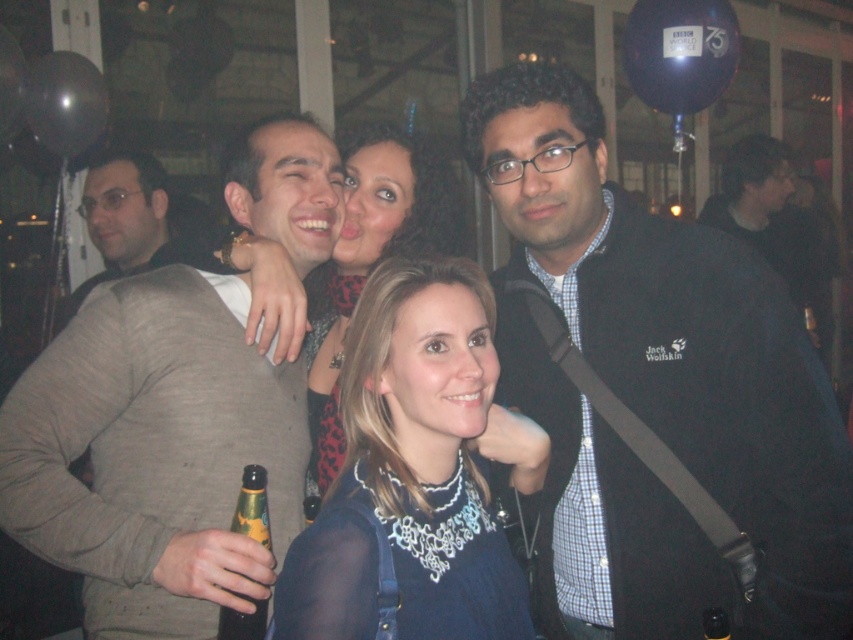
Does gray sweater at center have a larger size compared to matte blue dress at center?

Yes.

Can you confirm if gray sweater at center is shorter than matte blue dress at center?

No.

Is point (149, 524) positioned before point (474, 323)?

No, it is not.

The width and height of the screenshot is (853, 640). What are the coordinates of `gray sweater at center` in the screenshot? It's located at (154, 454).

Does black jack wolfskin jacket at center appear on the left side of green glass bottle at lower left?

In fact, black jack wolfskin jacket at center is to the right of green glass bottle at lower left.

Does point (776, 509) come behind point (254, 611)?

Yes, point (776, 509) is farther from viewer.

Is point (602, 157) positioned after point (253, 532)?

Yes, point (602, 157) is behind point (253, 532).

In order to click on black jack wolfskin jacket at center in this screenshot , I will do `click(656, 388)`.

Does gray sweater at center have a greater width compared to gray sweater at left?

No.

Is gray sweater at center positioned before gray sweater at left?

Yes, gray sweater at center is closer to the viewer.

Which is in front, point (196, 444) or point (132, 269)?

Point (196, 444) is in front.

Image resolution: width=853 pixels, height=640 pixels. I want to click on gray sweater at center, so click(x=154, y=454).